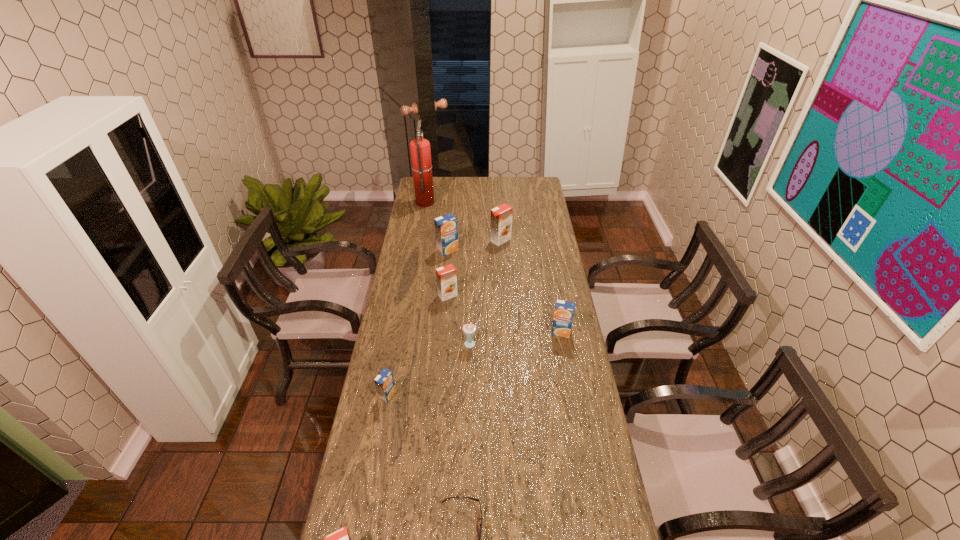
Find the location of `red fire extinguisher`. red fire extinguisher is located at coordinates (420, 150).

Where is `the farthest object`? the farthest object is located at coordinates (420, 150).

Find the location of `the fifth orange juice from left to right`. the fifth orange juice from left to right is located at coordinates (501, 216).

Locate an element on the screen. This screenshot has height=540, width=960. the biggest orange orange juice is located at coordinates (501, 216).

At what (x,y) coordinates should I click in order to perform the action: click on the second blue orange_juice from right to left. Please return your answer as a coordinate pair (x, y). The image size is (960, 540). Looking at the image, I should click on (446, 227).

This screenshot has height=540, width=960. What are the coordinates of `the farthest blue orange_juice` in the screenshot? It's located at (446, 227).

Where is `the second biggest orange orange juice`? the second biggest orange orange juice is located at coordinates (446, 276).

Where is `the second orange orange juice from right to left`? Image resolution: width=960 pixels, height=540 pixels. the second orange orange juice from right to left is located at coordinates (446, 276).

Identify the location of the rightmost orange juice. (564, 311).

This screenshot has width=960, height=540. I want to click on the fourth farthest orange juice, so click(x=564, y=311).